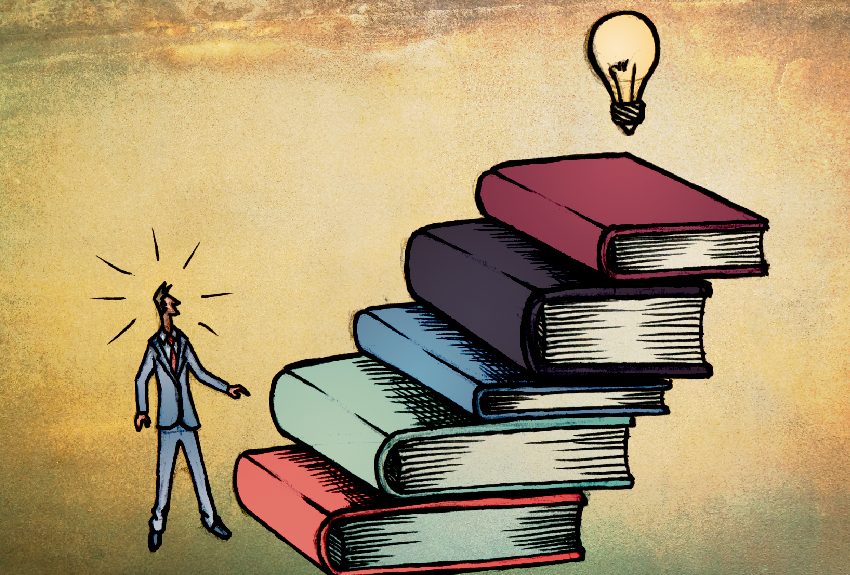
In order to click on book in this screenshot , I will do `click(302, 500)`, `click(348, 426)`, `click(414, 355)`, `click(471, 287)`, `click(561, 210)`.